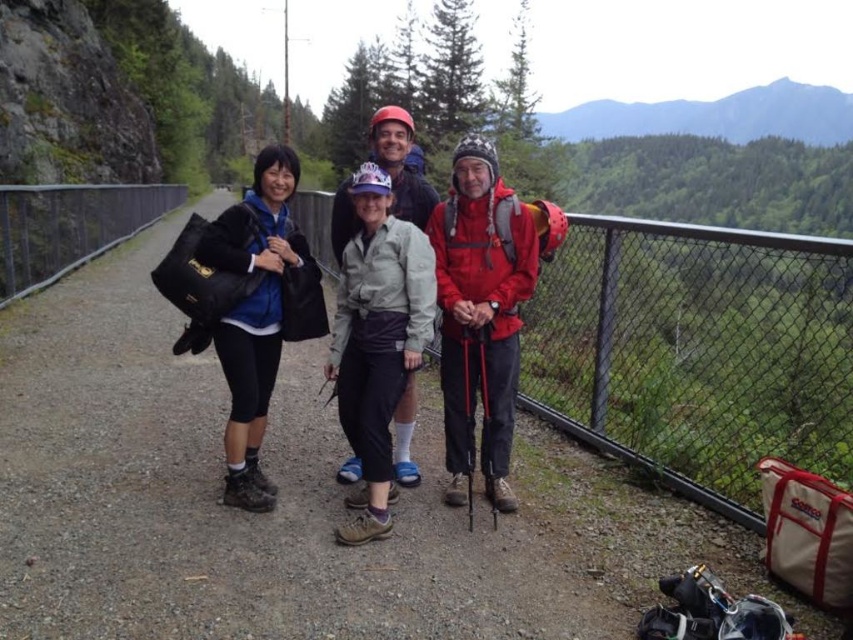
Can you confirm if matte gray jacket at center is wider than light gray fabric shirt at center?

No.

Which is in front, point (345, 355) or point (392, 220)?

Point (392, 220) is more forward.

Which is in front, point (373, 520) or point (358, 180)?

Point (373, 520)

Locate an element on the screen. matte gray jacket at center is located at coordinates (376, 321).

In the scene shown: Is matte black backpack at center positioned behind matte red jacket at center?

No, it is in front of matte red jacket at center.

Image resolution: width=853 pixels, height=640 pixels. Describe the element at coordinates (219, 500) in the screenshot. I see `matte black backpack at center` at that location.

Is point (160, 492) positioned behind point (508, 502)?

That is True.

At what (x,y) coordinates should I click in order to perform the action: click on matte black backpack at center. Please return your answer as a coordinate pair (x, y). The height and width of the screenshot is (640, 853). Looking at the image, I should click on (219, 500).

Does light gray fabric shirt at center have a smaller size compared to black matte jacket at left?

Correct, light gray fabric shirt at center occupies less space than black matte jacket at left.

Does light gray fabric shirt at center have a greater height compared to black matte jacket at left?

Incorrect, light gray fabric shirt at center's height is not larger of black matte jacket at left's.

Which is behind, point (368, 324) or point (236, 225)?

Point (368, 324)

Locate an element on the screen. This screenshot has width=853, height=640. light gray fabric shirt at center is located at coordinates (376, 340).